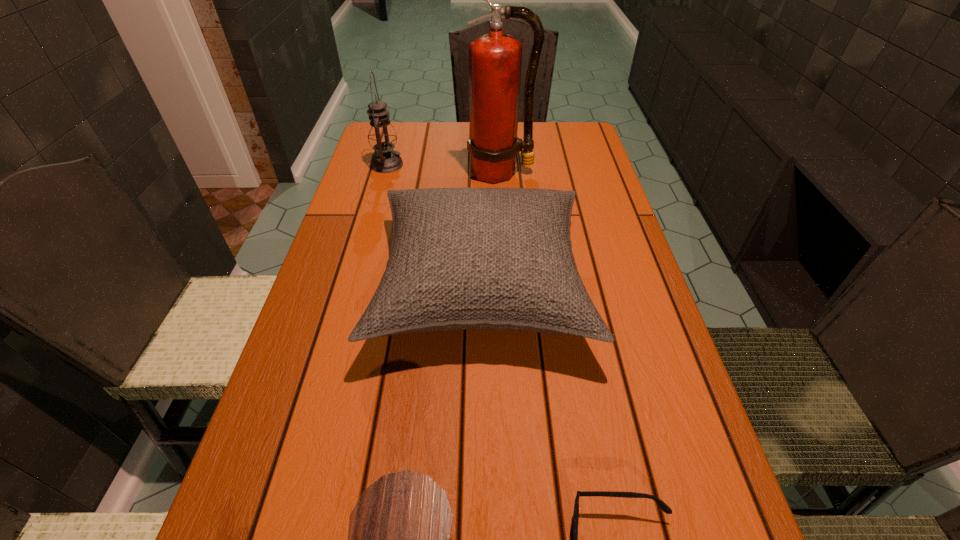
Locate an element on the screen. The width and height of the screenshot is (960, 540). object present at the right edge is located at coordinates (461, 258).

The width and height of the screenshot is (960, 540). I want to click on object present at the far left corner, so click(381, 135).

In the image, there is a desktop. Where is `vacant space at the left edge`? The width and height of the screenshot is (960, 540). vacant space at the left edge is located at coordinates tap(361, 188).

The width and height of the screenshot is (960, 540). What are the coordinates of `vacant space at the right edge` in the screenshot? It's located at (684, 435).

Where is `vacant space at the far left corner`? vacant space at the far left corner is located at coordinates (406, 141).

This screenshot has height=540, width=960. I want to click on free area in between the oil lamp and the fire extinguisher, so click(x=444, y=168).

The height and width of the screenshot is (540, 960). I want to click on object that stands as the third closest to the tallest object, so click(x=665, y=508).

The height and width of the screenshot is (540, 960). Find the location of `object that stands as the closest to the sunglasses`. object that stands as the closest to the sunglasses is located at coordinates (399, 532).